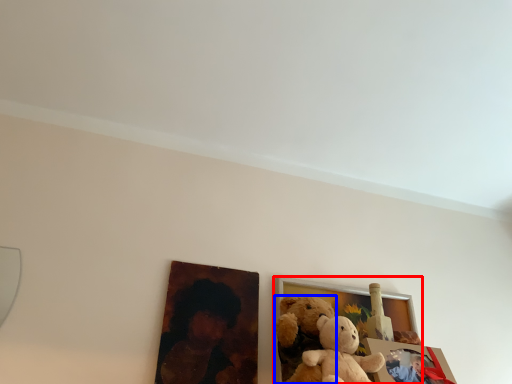
Question: Which of the following is the closest to the observer, picture frame (highlighted by a red box) or teddy bear (highlighted by a blue box)?

Choices:
 (A) picture frame
 (B) teddy bear

Answer: (B)